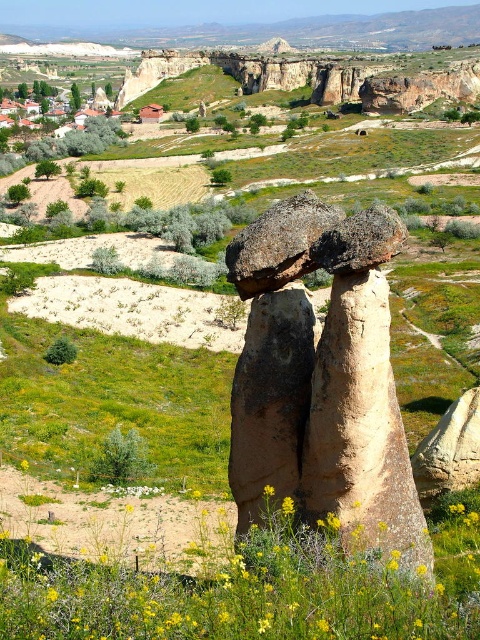
Can you confirm if brown textured rock formation at center is bigger than yellow soft textured wildflower at center?

Indeed, brown textured rock formation at center has a larger size compared to yellow soft textured wildflower at center.

Who is more distant from viewer, (320, 486) or (84, 595)?

Positioned behind is point (320, 486).

Locate an element on the screen. The height and width of the screenshot is (640, 480). brown textured rock formation at center is located at coordinates (323, 378).